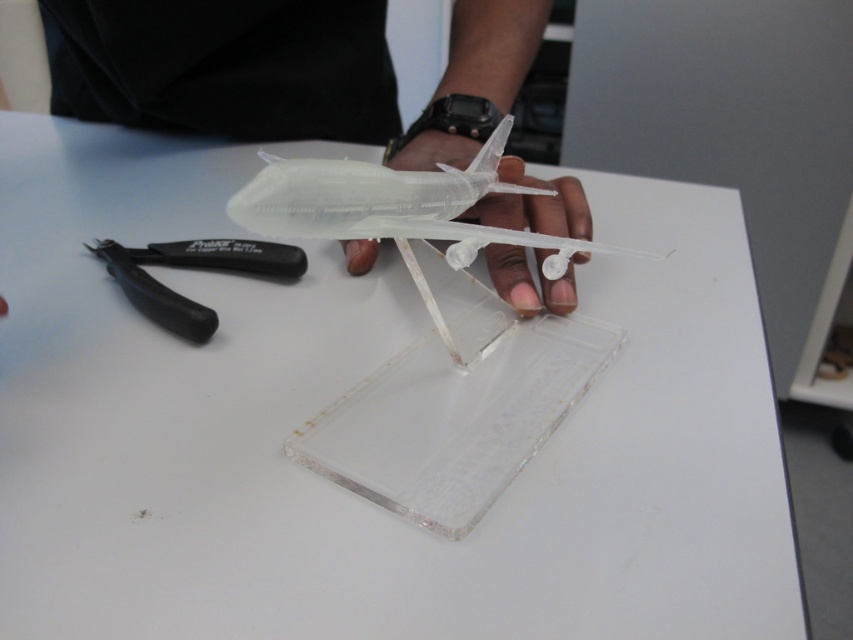
Image resolution: width=853 pixels, height=640 pixels. I want to click on transparent plastic airplane at center, so click(x=225, y=67).

At what (x,y) coordinates should I click in order to perform the action: click on transparent plastic airplane at center. Please return your answer as a coordinate pair (x, y). Image resolution: width=853 pixels, height=640 pixels. Looking at the image, I should click on (225, 67).

Identify the location of transparent plastic airplane at center. (225, 67).